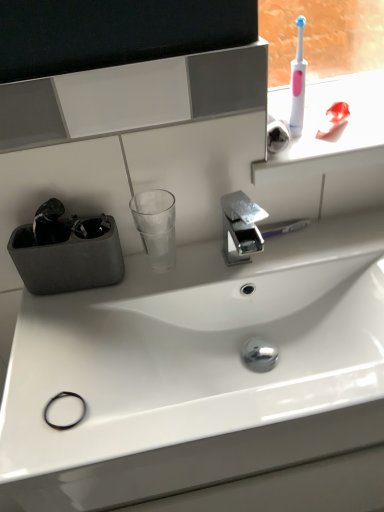
Identify the location of unoccupied region to the right of polished chrome tap at center. (307, 249).